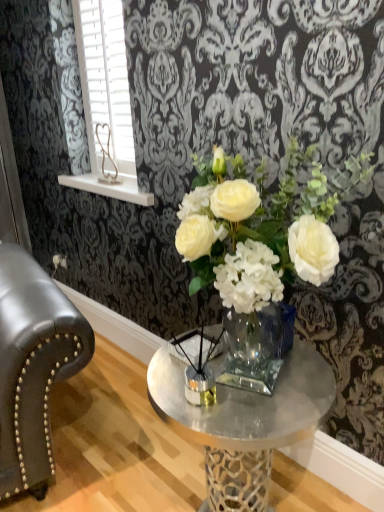
You are a GUI agent. You are given a task and a screenshot of the screen. Output one action in this format:
    pyautogui.click(x=<x>, y=<y>)
    Task: Click on the vacant space situated on the left part of clear glass vase at center
    The width and height of the screenshot is (384, 512).
    Given the screenshot: What is the action you would take?
    [x=102, y=468]